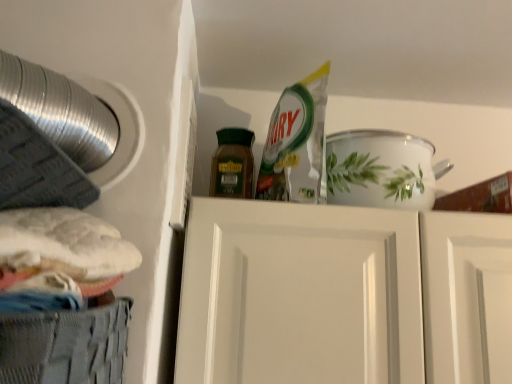
Describe the element at coordinates (66, 344) in the screenshot. I see `gray mesh basket at lower left` at that location.

This screenshot has height=384, width=512. In order to click on white glossy door at center in this screenshot , I will do `click(342, 295)`.

Consider the image. Is brown matte jar at center a part of white glossy door at center?

No, brown matte jar at center is located outside of white glossy door at center.

How different are the orientations of white glossy door at center and brown matte jar at center in degrees?

The angle between the facing direction of white glossy door at center and the facing direction of brown matte jar at center is 0.643 degrees.

Which object is further away from the camera, white glossy door at center or brown matte jar at center?

brown matte jar at center is further away from the camera.

Is white glossy door at center oriented away from brown matte jar at center?

No, white glossy door at center is not facing away from brown matte jar at center.

Could you tell me if gray mesh basket at lower left is turned towards white glossy door at center?

No, gray mesh basket at lower left is not oriented towards white glossy door at center.

Is gray mesh basket at lower left far away from white glossy door at center?

They are positioned close to each other.

From the image's perspective, which one is positioned lower, gray mesh basket at lower left or white glossy door at center?

white glossy door at center is shown below in the image.

Considering the sizes of objects gray mesh basket at lower left and white glossy door at center in the image provided, who is taller, gray mesh basket at lower left or white glossy door at center?

Standing taller between the two is white glossy door at center.

Is white glossy door at center not close to gray mesh basket at lower left?

No, white glossy door at center is in close proximity to gray mesh basket at lower left.

From a real-world perspective, who is located higher, white glossy door at center or gray mesh basket at lower left?

white glossy door at center, from a real-world perspective.

What are the coordinates of `door that is below the gray mesh basket at lower left (from the image's perspective)` in the screenshot? It's located at (342, 295).

How many degrees apart are the facing directions of white glossy door at center and gray mesh basket at lower left?

They differ by 89.3 degrees in their facing directions.

Does point (13, 344) appear closer or farther from the camera than point (245, 161)?

Point (13, 344).

Can you confirm if gray mesh basket at lower left is shorter than brown matte jar at center?

Correct, gray mesh basket at lower left is not as tall as brown matte jar at center.

From the image's perspective, between gray mesh basket at lower left and brown matte jar at center, who is located below?

gray mesh basket at lower left is shown below in the image.

Consider the image. Can you confirm if gray mesh basket at lower left is smaller than brown matte jar at center?

Incorrect, gray mesh basket at lower left is not smaller in size than brown matte jar at center.

Between point (234, 184) and point (45, 369), which one is positioned in front?

The point (45, 369) is closer to the camera.

Consider the image. Is brown matte jar at center smaller than gray mesh basket at lower left?

Indeed, brown matte jar at center has a smaller size compared to gray mesh basket at lower left.

Based on the photo, is brown matte jar at center inside the boundaries of gray mesh basket at lower left, or outside?

brown matte jar at center exists outside the volume of gray mesh basket at lower left.

Between point (217, 185) and point (269, 277), which one is positioned in front?

Positioned in front is point (269, 277).

From a real-world perspective, is brown matte jar at center physically located above or below white glossy door at center?

brown matte jar at center is situated higher than white glossy door at center in the real world.

Is brown matte jar at center far from white glossy door at center?

No, there isn't a large distance between brown matte jar at center and white glossy door at center.

How different are the orientations of brown matte jar at center and white glossy door at center in degrees?

There is a 0.643-degree angle between the facing directions of brown matte jar at center and white glossy door at center.

This screenshot has width=512, height=384. Find the location of `door in front of the brown matte jar at center`. door in front of the brown matte jar at center is located at coordinates (342, 295).

Image resolution: width=512 pixels, height=384 pixels. In order to click on door lying below the gray mesh basket at lower left (from the image's perspective) in this screenshot , I will do `click(342, 295)`.

From the image, which object appears to be nearer to white glossy door at center, brown matte jar at center or gray mesh basket at lower left?

brown matte jar at center is positioned closer to the anchor white glossy door at center.

Based on the photo, looking at the image, which one is located further to brown matte jar at center, white glossy door at center or gray mesh basket at lower left?

Among the two, gray mesh basket at lower left is located further to brown matte jar at center.

When comparing their distances from brown matte jar at center, does gray mesh basket at lower left or white glossy door at center seem further?

gray mesh basket at lower left is positioned further to the anchor brown matte jar at center.

Which object lies nearer to the anchor point gray mesh basket at lower left, brown matte jar at center or white glossy door at center?

Among the two, white glossy door at center is located nearer to gray mesh basket at lower left.

From the image, which object appears to be farther from gray mesh basket at lower left, white glossy door at center or brown matte jar at center?

brown matte jar at center is further to gray mesh basket at lower left.

Which object lies further to the anchor point white glossy door at center, gray mesh basket at lower left or brown matte jar at center?

The object further to white glossy door at center is gray mesh basket at lower left.

Find the location of a particular element. The height and width of the screenshot is (384, 512). door between gray mesh basket at lower left and brown matte jar at center in the front-back direction is located at coordinates (342, 295).